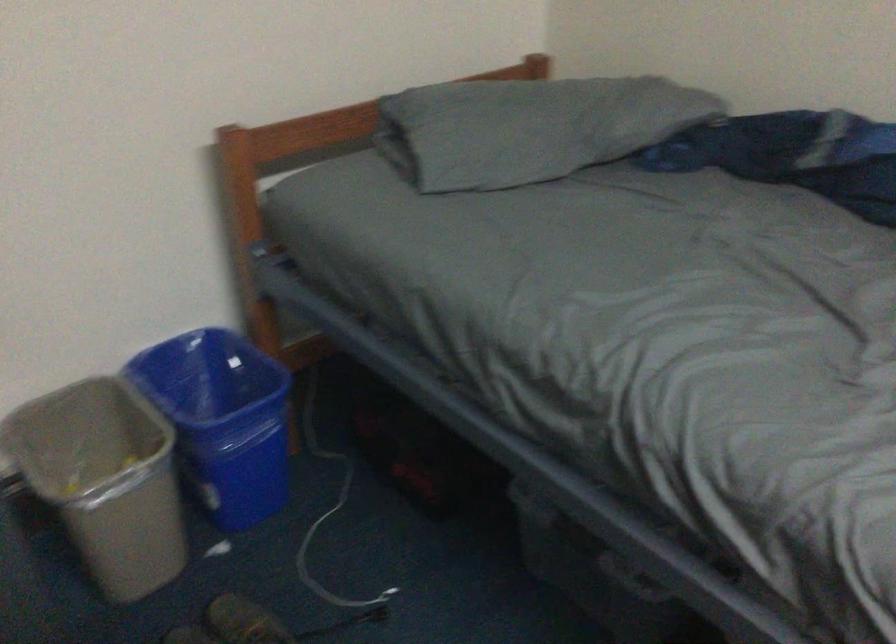
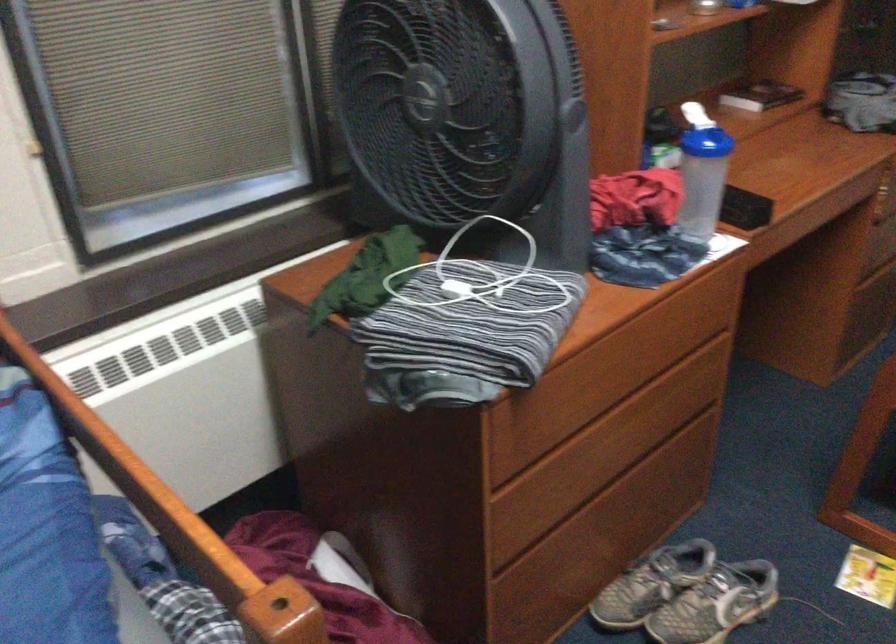
The images are taken continuously from a first-person perspective. In which direction is your viewpoint rotating?

The rotation direction of the camera is right-down.